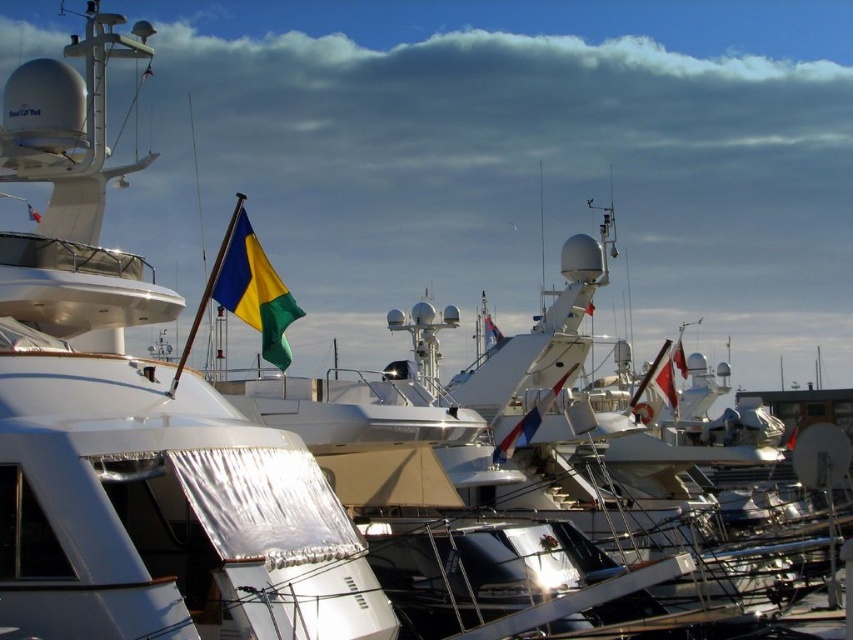
Who is positioned more to the left, black fabric flag at upper right or blue fabric flag at center?

blue fabric flag at center is more to the left.

Which is more to the right, black fabric flag at upper right or blue fabric flag at center?

From the viewer's perspective, black fabric flag at upper right appears more on the right side.

The image size is (853, 640). I want to click on black fabric flag at upper right, so click(663, 376).

Does white glossy boat at upper left appear under blue fabric flag at center?

Actually, white glossy boat at upper left is above blue fabric flag at center.

Between point (303, 448) and point (492, 336), which one is positioned behind?

Point (492, 336)

This screenshot has height=640, width=853. In order to click on white glossy boat at upper left in this screenshot , I will do `click(138, 424)`.

Can you confirm if black fabric flag at upper right is positioned to the left of white fabric flag at upper center?

Indeed, black fabric flag at upper right is positioned on the left side of white fabric flag at upper center.

Does black fabric flag at upper right have a greater height compared to white fabric flag at upper center?

Yes.

At what (x,y) coordinates should I click in order to perform the action: click on black fabric flag at upper right. Please return your answer as a coordinate pair (x, y). Looking at the image, I should click on (663, 376).

At what (x,y) coordinates should I click in order to perform the action: click on black fabric flag at upper right. Please return your answer as a coordinate pair (x, y). Looking at the image, I should click on (663, 376).